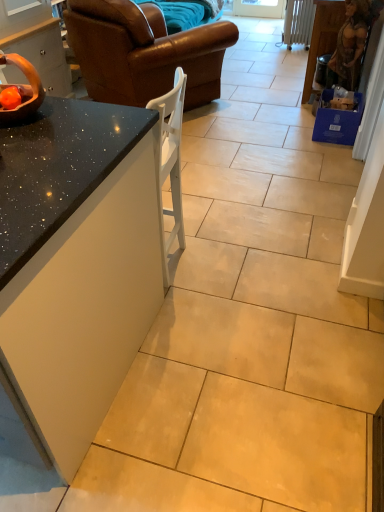
Find the location of a particular element. The image size is (384, 512). spots to the right of wooden bowl at upper left is located at coordinates (81, 114).